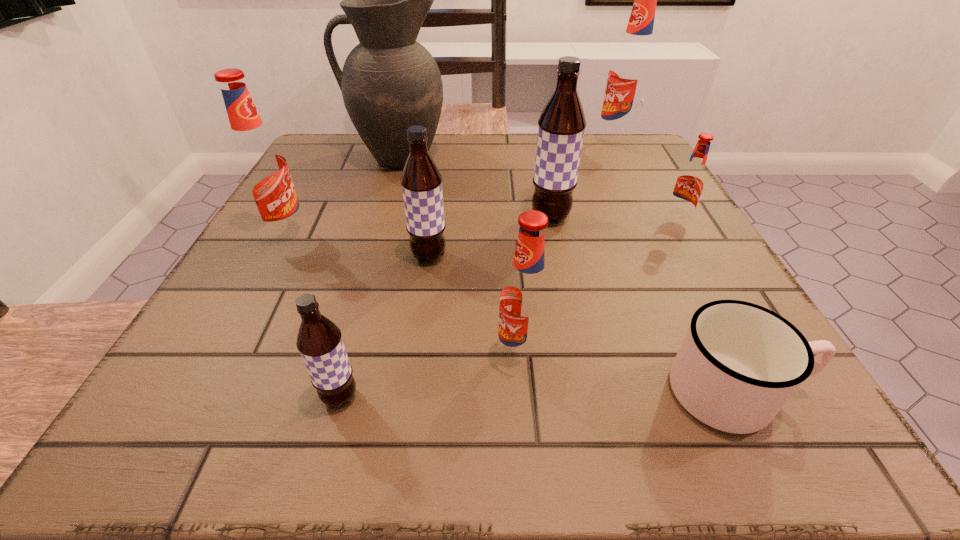
I want to click on the fifth object from left to right, so click(525, 304).

Identify the location of the smallest red root beer. The width and height of the screenshot is (960, 540). (690, 182).

Locate an element on the screen. the smallest brown root beer is located at coordinates (319, 341).

What are the coordinates of `the leftmost brown root beer` in the screenshot? It's located at (319, 341).

Image resolution: width=960 pixels, height=540 pixels. In order to click on the shortest object in this screenshot , I will do `click(739, 363)`.

Locate an element on the screen. The height and width of the screenshot is (540, 960). vacant space located on the left of the farthest red root beer is located at coordinates (503, 144).

Locate an element on the screen. This screenshot has height=540, width=960. vacant space situated on the side of the pitcher with the handle is located at coordinates (328, 158).

Find the location of a particular element. free space located on the side of the pitcher with the handle is located at coordinates (324, 158).

What are the coordinates of `vacant space located on the back of the second biggest red root beer` in the screenshot? It's located at (315, 181).

Locate an element on the screen. blank space located on the right of the rightmost brown root beer is located at coordinates (621, 218).